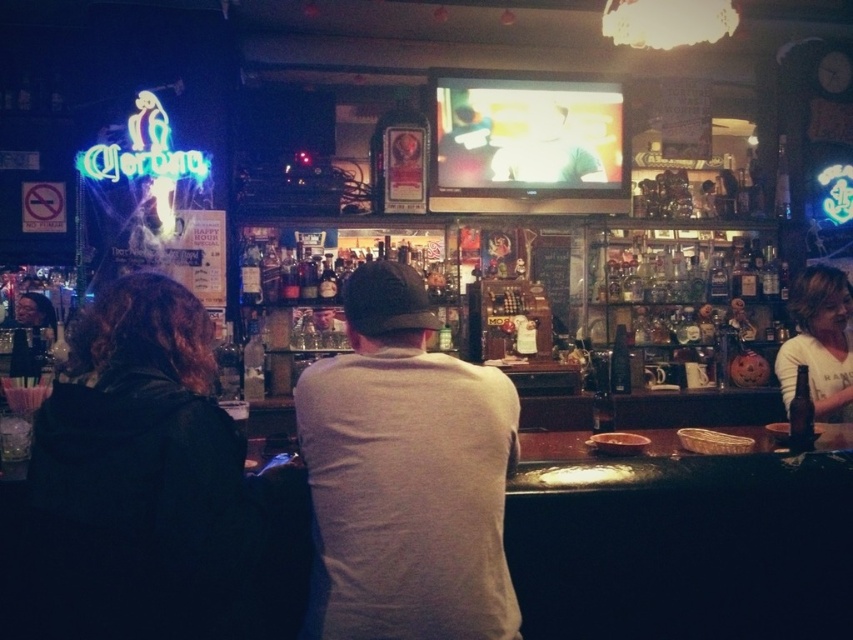
You are standing at the entrance of the bar and want to approach the person wearing the black leather jacket at left. Based on their position in the image, which direction should you move relative to the entrance?

The black leather jacket at left is located at point (141, 481) in the image, so you should move towards the left side of the bar to reach them.

You are a bartender at the bar. You need to place a new neon sign at the same location as the dark gray hoodie at center. What coordinates should you use?

You should place the new neon sign at coordinates point (x=160, y=492), which is where the dark gray hoodie at center is located.

You are a photographer trying to capture a candid shot of the two people at the bar. Since you want to ensure both subjects are in focus, you need to know which one is taller. Which person is taller between the black leather jacket at left and the light brown hair at right?

The black leather jacket at left is much taller than the light brown hair at right, so the person wearing the black leather jacket at left is taller.